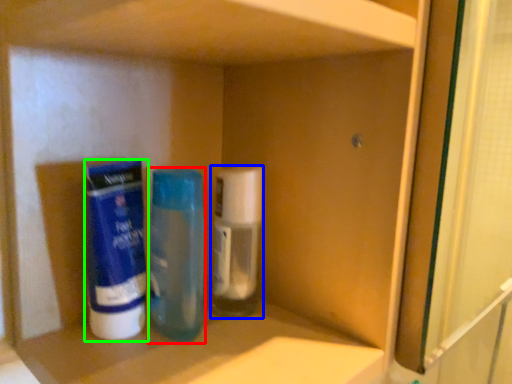
Question: Considering the real-world distances, which object is farthest from bottle (highlighted by a red box)? bottle (highlighted by a blue box) or cleaning product (highlighted by a green box)?

Choices:
 (A) bottle
 (B) cleaning product

Answer: (B)